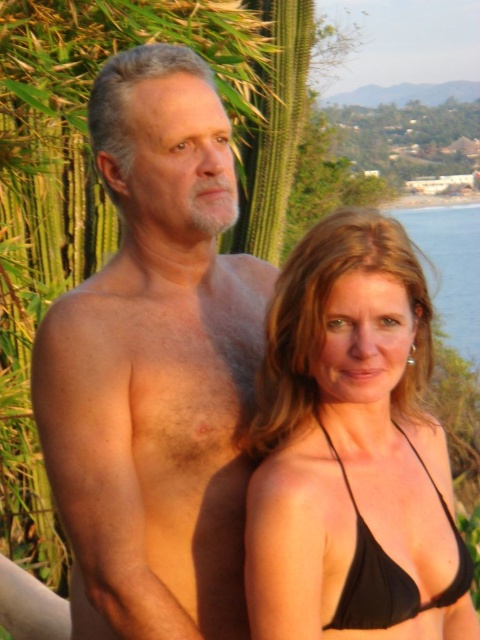
Is black bikini top at center taller than blue water at right?

No.

Looking at this image, which is more to the right, black bikini top at center or blue water at right?

blue water at right is more to the right.

At what (x,y) coordinates should I click in order to perform the action: click on black bikini top at center. Please return your answer as a coordinate pair (x, y). The height and width of the screenshot is (640, 480). Looking at the image, I should click on (351, 451).

At what (x,y) coordinates should I click in order to perform the action: click on black bikini top at center. Please return your answer as a coordinate pair (x, y). The width and height of the screenshot is (480, 640). Looking at the image, I should click on (351, 451).

What do you see at coordinates (351, 451) in the screenshot?
I see `black bikini top at center` at bounding box center [351, 451].

Locate an element on the screen. black bikini top at center is located at coordinates (351, 451).

Who is more forward, (155,531) or (327,624)?

Point (327,624) is more forward.

Is smooth skin torso at center shorter than black matte bikini top at center?

No.

The height and width of the screenshot is (640, 480). In order to click on smooth skin torso at center in this screenshot , I will do `click(155, 365)`.

Find the location of a particular element. smooth skin torso at center is located at coordinates (155, 365).